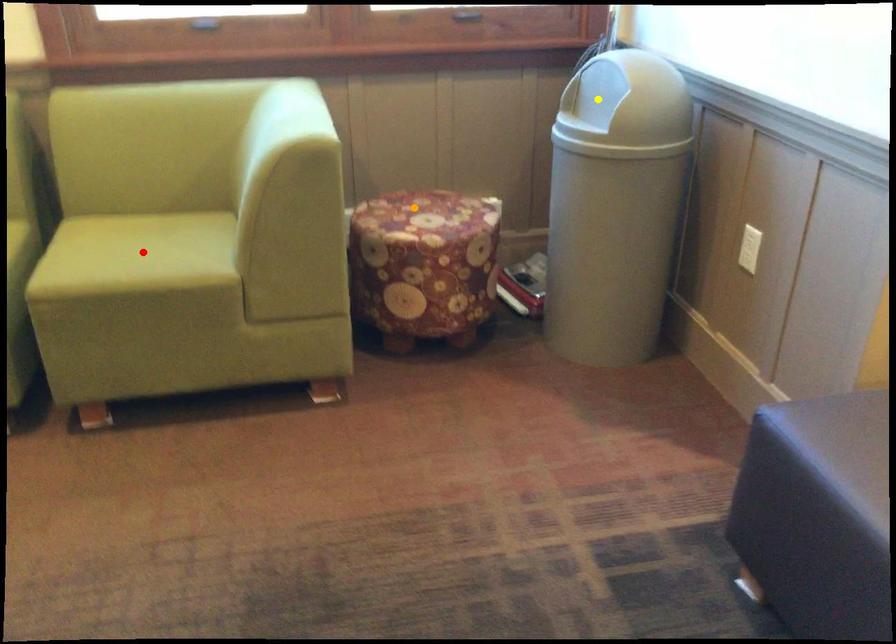
Order these from nearest to farthest:
- yellow point
- orange point
- red point

orange point < red point < yellow point